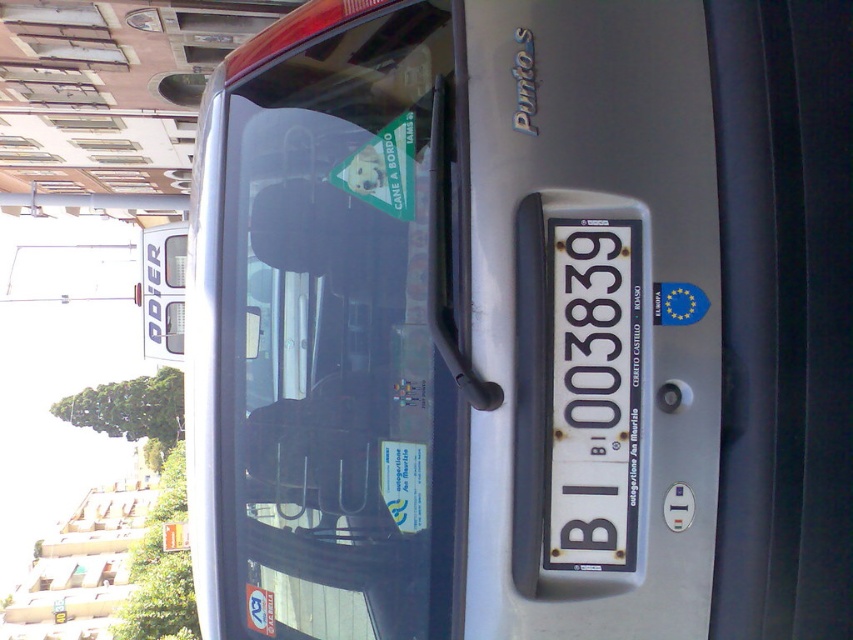
Question: Is white metallic license plate at center below white glossy sticker at lower left?

Choices:
 (A) no
 (B) yes

Answer: (A)

Question: Does white metallic license plate at center appear on the left side of white paper sticker at center?

Choices:
 (A) yes
 (B) no

Answer: (B)

Question: Which of the following is the farthest from the observer?

Choices:
 (A) (265, 618)
 (B) (679, 282)
 (C) (405, 483)

Answer: (A)

Question: Which is nearer to the white paper sticker at center?

Choices:
 (A) transparent glass windshield at center
 (B) white metallic license plate at center
 (C) white glossy sticker at lower left

Answer: (A)

Question: Does blue fabric flag at center have a larger size compared to white glossy sticker at lower left?

Choices:
 (A) no
 (B) yes

Answer: (A)

Question: Based on their relative distances, which object is farther from the white metallic license plate at center?

Choices:
 (A) transparent glass windshield at center
 (B) white paper sticker at center

Answer: (A)